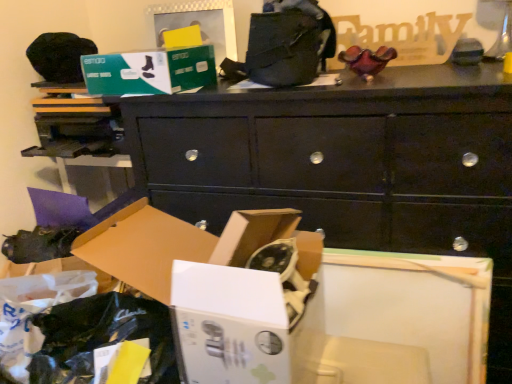
Question: Is green cardboard box at upper center, which ranks as the 2th storage box in bottom-to-top order, closer to camera compared to matte black shoe at lower left?

Choices:
 (A) no
 (B) yes

Answer: (B)

Question: Is green cardboard box at upper center, placed as the first storage box when sorted from top to bottom, directly adjacent to matte black shoe at lower left?

Choices:
 (A) yes
 (B) no

Answer: (B)

Question: Can you confirm if green cardboard box at upper center, which ranks as the 2th storage box in bottom-to-top order, is positioned to the left of matte black shoe at lower left?

Choices:
 (A) yes
 (B) no

Answer: (B)

Question: Is green cardboard box at upper center, which ranks as the 2th storage box in bottom-to-top order, facing away from matte black shoe at lower left?

Choices:
 (A) yes
 (B) no

Answer: (B)

Question: Does green cardboard box at upper center, placed as the first storage box when sorted from top to bottom, appear on the right side of matte black shoe at lower left?

Choices:
 (A) yes
 (B) no

Answer: (A)

Question: Is green cardboard box at upper center, which ranks as the 2th storage box in bottom-to-top order, smaller than matte black shoe at lower left?

Choices:
 (A) no
 (B) yes

Answer: (A)

Question: Is green cardboard box at upper center, placed as the first storage box when sorted from top to bottom, positioned in front of white cardboard box at lower left, the 1th storage box from the bottom?

Choices:
 (A) no
 (B) yes

Answer: (A)

Question: Is green cardboard box at upper center, which ranks as the 2th storage box in bottom-to-top order, not inside white cardboard box at lower left, the second storage box viewed from the top?

Choices:
 (A) yes
 (B) no

Answer: (A)

Question: From a real-world perspective, is green cardboard box at upper center, which ranks as the 2th storage box in bottom-to-top order, physically above white cardboard box at lower left, the 1th storage box from the bottom?

Choices:
 (A) yes
 (B) no

Answer: (A)

Question: Is green cardboard box at upper center, which ranks as the 2th storage box in bottom-to-top order, beside white cardboard box at lower left, the 1th storage box from the bottom?

Choices:
 (A) yes
 (B) no

Answer: (B)

Question: Are green cardboard box at upper center, placed as the first storage box when sorted from top to bottom, and white cardboard box at lower left, the second storage box viewed from the top, located far from each other?

Choices:
 (A) yes
 (B) no

Answer: (B)

Question: Can white cardboard box at lower left, the 1th storage box from the bottom, be found inside green cardboard box at upper center, placed as the first storage box when sorted from top to bottom?

Choices:
 (A) no
 (B) yes

Answer: (A)

Question: From a real-world perspective, is matte black shoe at lower left under green cardboard box at upper center, placed as the first storage box when sorted from top to bottom?

Choices:
 (A) yes
 (B) no

Answer: (A)